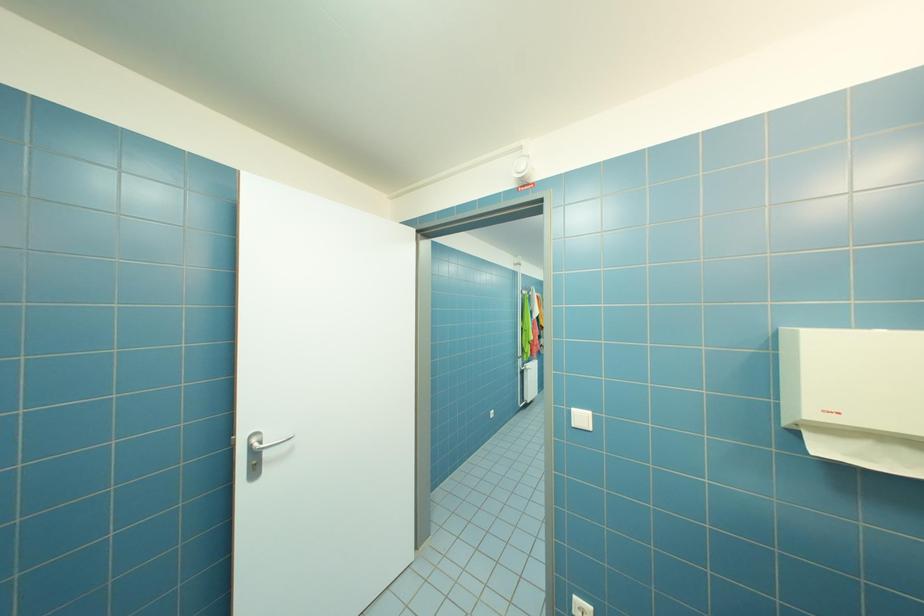
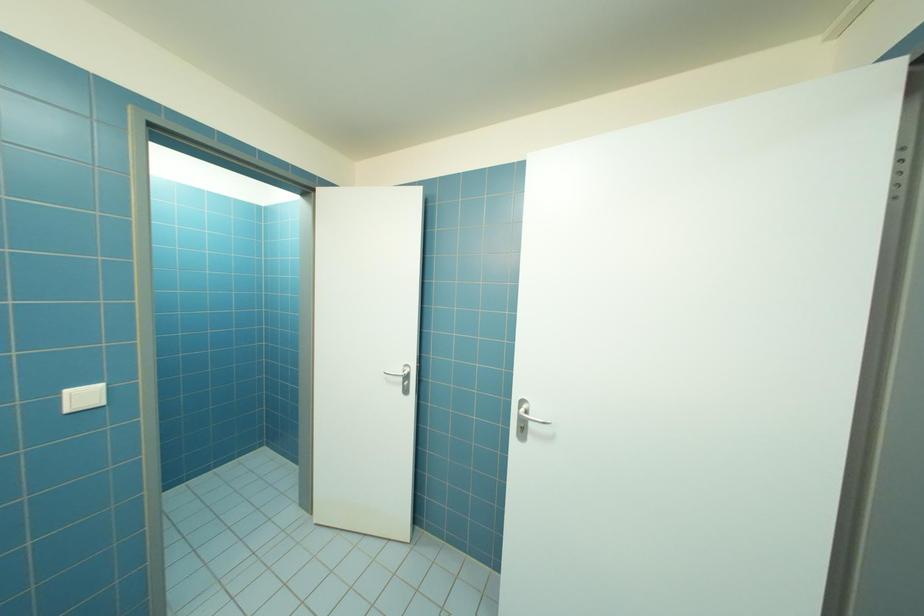
Question: The first image is from the beginning of the video and the second image is from the end. How did the camera likely rotate when shooting the video?

Choices:
 (A) Left
 (B) Right
 (C) Up
 (D) Down

Answer: (A)